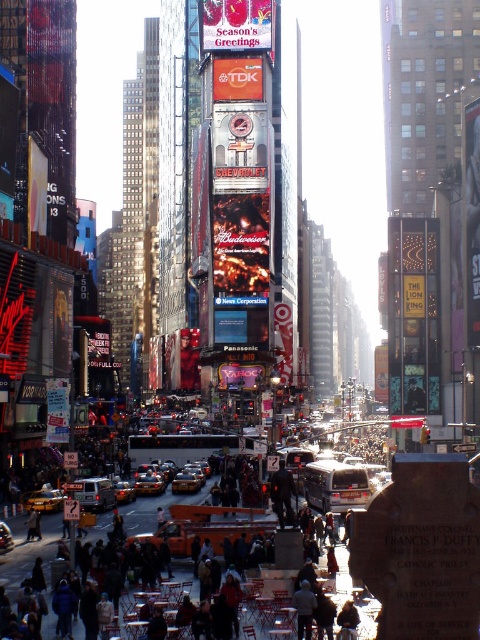
You are standing at the street level in Times Square and see the dark gray concrete crowd at center and the yellowmetallictaxi at center. Which object is nearer to you?

Answer: The dark gray concrete crowd at center is closer to the viewer than the yellowmetallictaxi at center.

From the picture: You are a photographer standing at the corner of the street in Times Square. You want to capture both the yellowmattetaxi at lower left and the yellowmattetaxi at center in a single wide shot. Which taxi should be closer to the camera to ensure both fit in the frame?

The yellowmattetaxi at lower left has a smaller width than the yellowmattetaxi at center, so positioning the smaller taxi closer to the camera will help both fit within the frame.